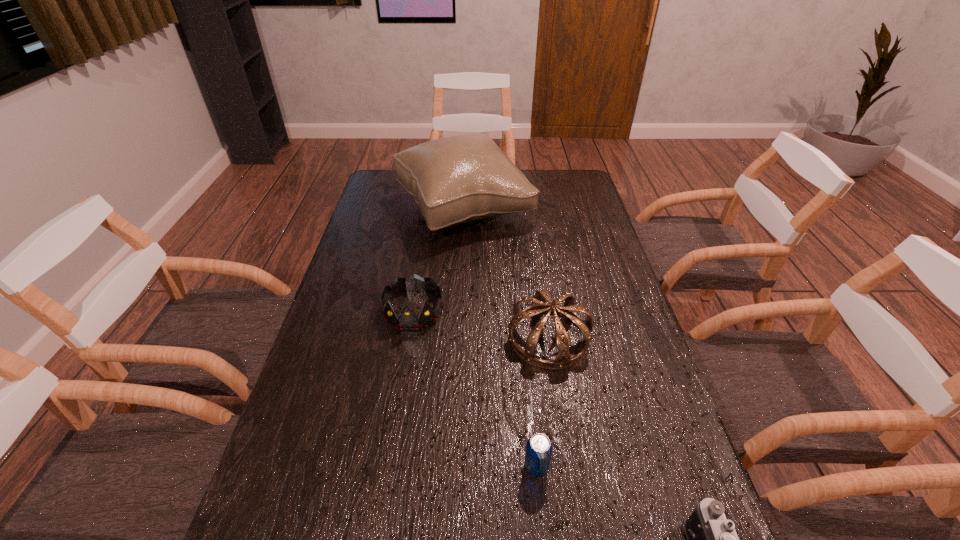
Locate an element on the screen. free area in between the right tiara and the beer can is located at coordinates (542, 402).

Locate an element on the screen. This screenshot has height=540, width=960. vacant point located between the second tallest object and the farthest object is located at coordinates (507, 273).

You are a GUI agent. You are given a task and a screenshot of the screen. Output one action in this format:
    pyautogui.click(x=<x>, y=<y>)
    Task: Click on the free spot between the cushion and the beer can
    
    Given the screenshot: What is the action you would take?
    pyautogui.click(x=500, y=338)

Image resolution: width=960 pixels, height=540 pixels. I want to click on vacant region between the beer can and the taller tiara, so click(542, 402).

Find the location of a particular element. The height and width of the screenshot is (540, 960). the third closest object to the left tiara is located at coordinates (539, 448).

Image resolution: width=960 pixels, height=540 pixels. Identify the location of object that stands as the second closest to the fourth shortest object. (539, 448).

You are a GUI agent. You are given a task and a screenshot of the screen. Output one action in this format:
    pyautogui.click(x=<x>, y=<y>)
    Task: Click on the free space that satisfies the following two spatial constraints: 1. at the front of the second nearest object with jewels; 2. on the left side of the left tiara
    
    Given the screenshot: What is the action you would take?
    pyautogui.click(x=388, y=467)

Where is `free space in the image that satisfies the following two spatial constraints: 1. at the front of the right tiara with jewels; 2. on the left side of the shorter tiara`? Image resolution: width=960 pixels, height=540 pixels. free space in the image that satisfies the following two spatial constraints: 1. at the front of the right tiara with jewels; 2. on the left side of the shorter tiara is located at coordinates (409, 338).